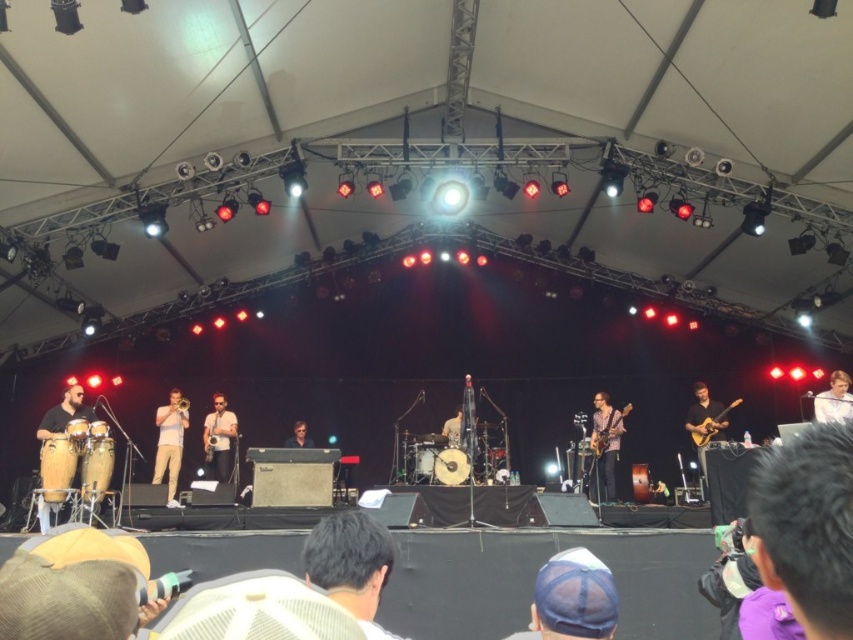
Question: Can you confirm if dark hair at lower right is positioned to the right of matte brown conga at left?

Choices:
 (A) yes
 (B) no

Answer: (A)

Question: Which point appears closest to the camera in this image?

Choices:
 (A) (457, 413)
 (B) (154, 470)
 (C) (300, 429)

Answer: (B)

Question: Is matte beige saxophone at center further to camera compared to matte brown conga at left?

Choices:
 (A) no
 (B) yes

Answer: (B)

Question: Does matte beige saxophone at center have a larger size compared to matte brown conga at left?

Choices:
 (A) no
 (B) yes

Answer: (B)

Question: Which point is farther from the camera taking this photo?

Choices:
 (A) (51, 422)
 (B) (213, 452)
 (C) (786, 563)

Answer: (B)

Question: Which point is farther to the camera?

Choices:
 (A) (849, 577)
 (B) (595, 451)
 (C) (227, 417)

Answer: (C)